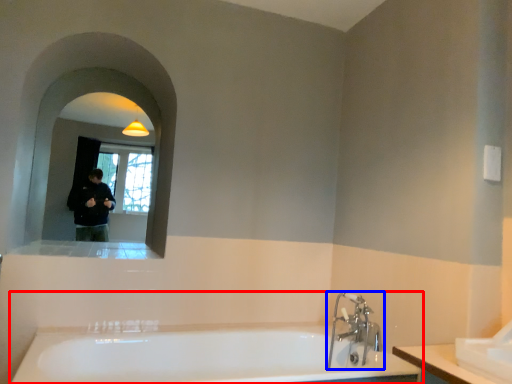
Question: Which object appears farthest to the camera in this image, bathtub (highlighted by a red box) or tap (highlighted by a blue box)?

Choices:
 (A) bathtub
 (B) tap

Answer: (B)